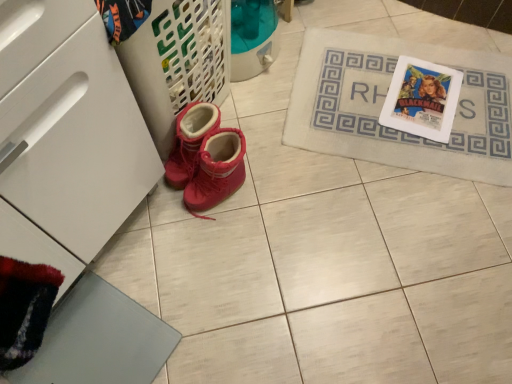
In order to click on blank space situated above beige fabric bath mat at upper right (from a real-world perspective) in this screenshot , I will do `click(408, 96)`.